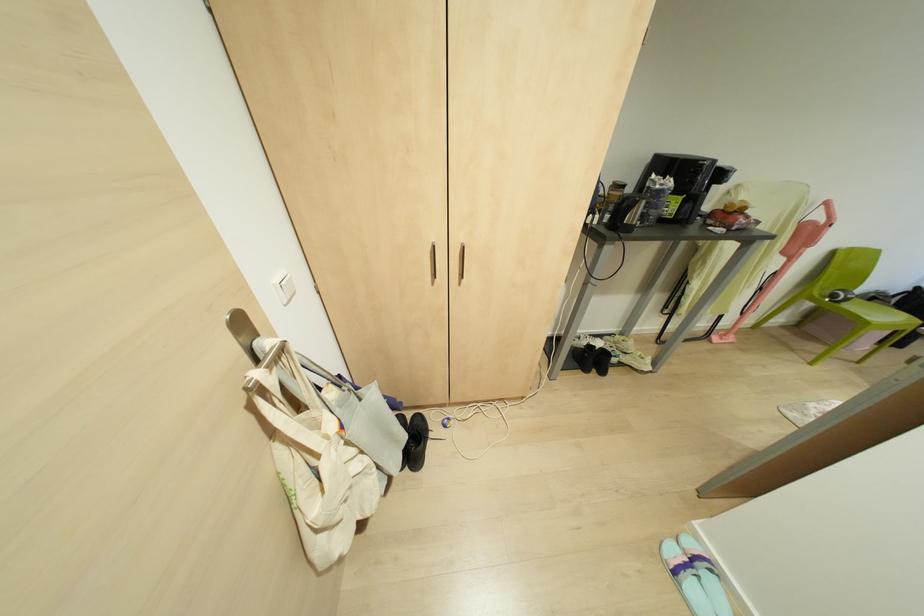
Locate an element on the screen. This screenshot has height=616, width=924. chair sitting surface is located at coordinates (874, 310).